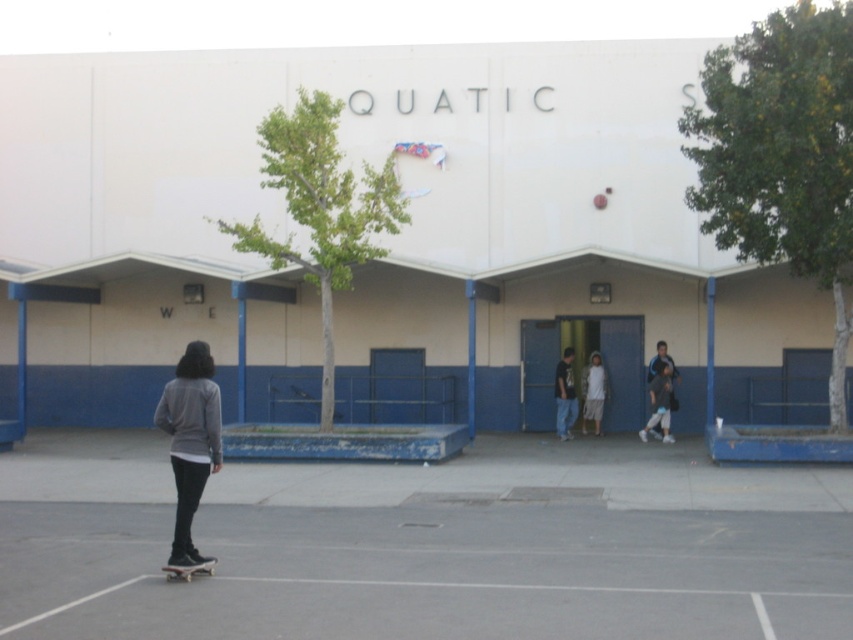
In the scene shown: Which of these two, white cotton shirt at center or black matte skateboard at lower left, stands taller?

With more height is white cotton shirt at center.

Who is positioned more to the left, white cotton shirt at center or black matte skateboard at lower left?

black matte skateboard at lower left is more to the left.

What are the coordinates of `white cotton shirt at center` in the screenshot? It's located at (x=593, y=392).

This screenshot has height=640, width=853. Find the location of `white cotton shirt at center`. white cotton shirt at center is located at coordinates (593, 392).

Does gray sweatshirt at center appear under light blue jeans at center?

Correct, gray sweatshirt at center is located below light blue jeans at center.

Is gray sweatshirt at center closer to the viewer compared to light blue jeans at center?

Yes, it is in front of light blue jeans at center.

Does point (196, 365) come closer to viewer compared to point (657, 355)?

Yes, point (196, 365) is closer to viewer.

Locate an element on the screen. gray sweatshirt at center is located at coordinates (190, 442).

Is gray sweatshirt at center to the left of black matte skateboard at lower left from the viewer's perspective?

Correct, you'll find gray sweatshirt at center to the left of black matte skateboard at lower left.

At what (x,y) coordinates should I click in order to perform the action: click on gray sweatshirt at center. Please return your answer as a coordinate pair (x, y). This screenshot has width=853, height=640. Looking at the image, I should click on point(190,442).